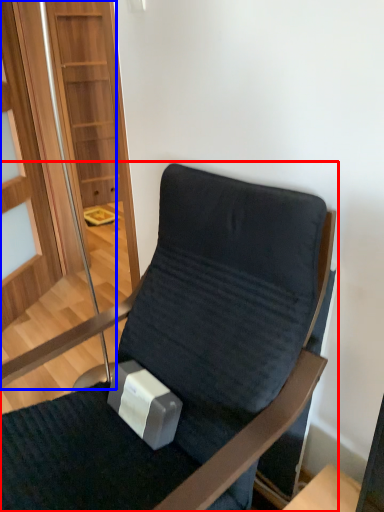
Question: Among these objects, which one is nearest to the camera, chair (highlighted by a red box) or glass door (highlighted by a blue box)?

Choices:
 (A) chair
 (B) glass door

Answer: (A)